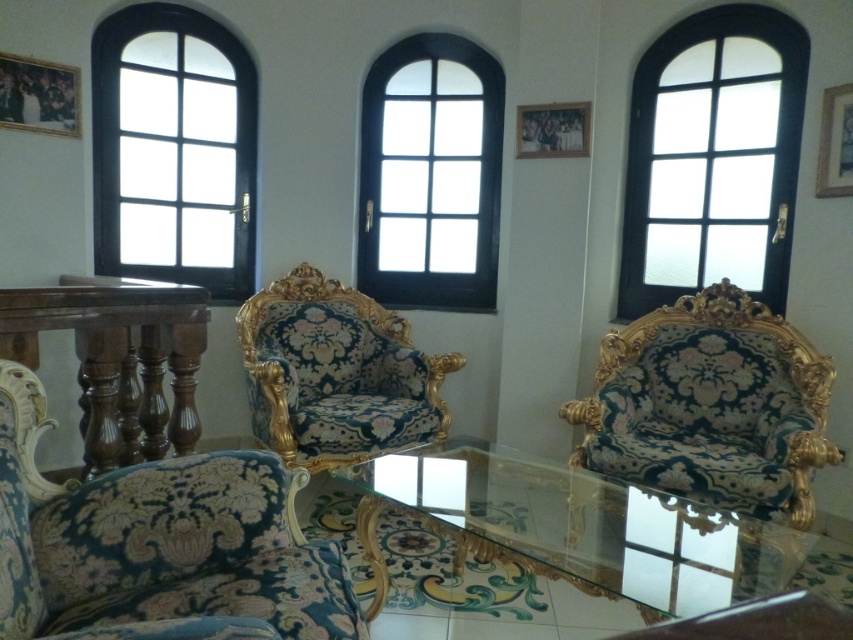
Is matte black window at upper right above velvet/goldenchair at center?

Correct, matte black window at upper right is located above velvet/goldenchair at center.

Can you confirm if matte black window at upper right is positioned below velvet/goldenchair at center?

Actually, matte black window at upper right is above velvet/goldenchair at center.

Where is `matte black window at upper right`? This screenshot has height=640, width=853. matte black window at upper right is located at coordinates (712, 157).

The image size is (853, 640). I want to click on matte black window at upper right, so click(712, 157).

Which is behind, point (389, 150) or point (543, 106)?

Positioned behind is point (389, 150).

You are a GUI agent. You are given a task and a screenshot of the screen. Output one action in this format:
    pyautogui.click(x=<x>, y=<y>)
    Task: Click on the black matte window at center
    The image size is (853, 640).
    Given the screenshot: What is the action you would take?
    pyautogui.click(x=430, y=173)

I want to click on black matte window at center, so click(430, 173).

Consider the image. Does matte black window at upper right have a greater width compared to polished wood table at left?

Yes.

Which of these two, matte black window at upper right or polished wood table at left, stands taller?

Standing taller between the two is matte black window at upper right.

Where is `matte black window at upper right`? matte black window at upper right is located at coordinates (712, 157).

Find the location of a particular element. This screenshot has width=853, height=640. matte black window at upper right is located at coordinates (712, 157).